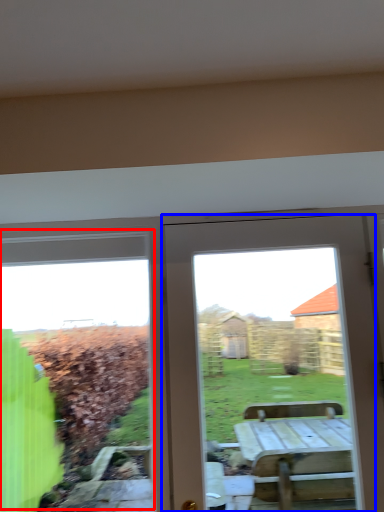
Question: Which point is closer to the camera, bay window (highlighted by a red box) or door (highlighted by a blue box)?

Choices:
 (A) bay window
 (B) door

Answer: (B)